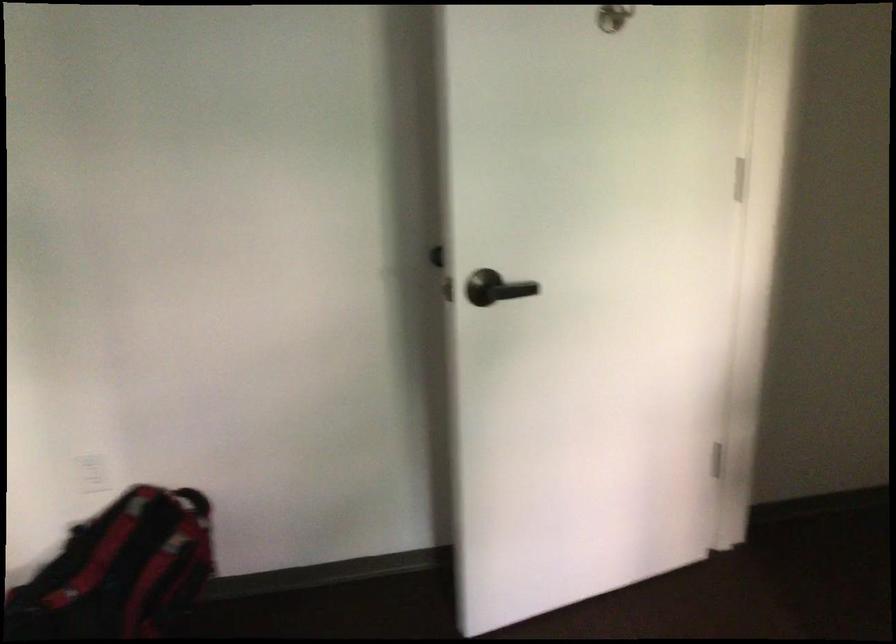
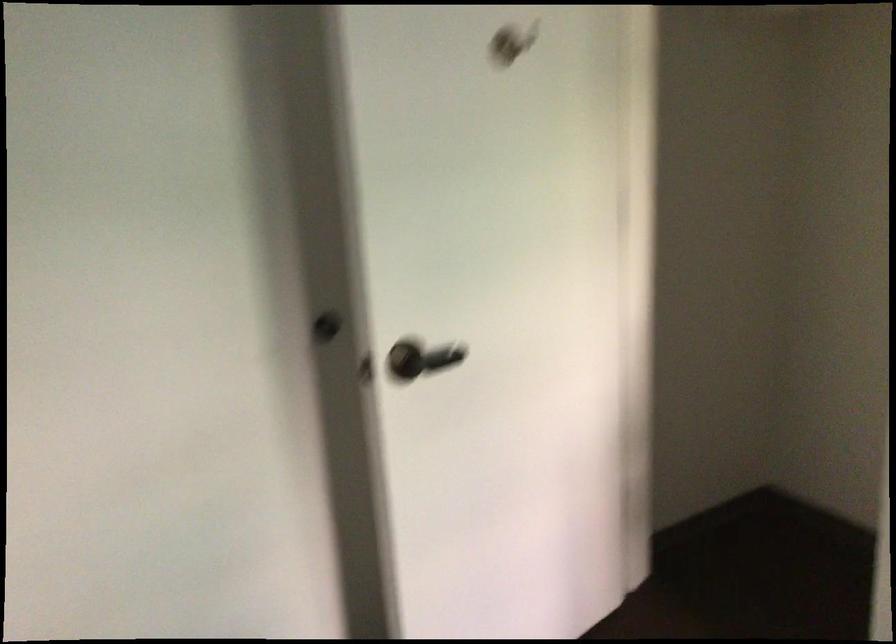
Where in the second image is the point corresponding to the point at 479,283 from the first image?

(407, 359)